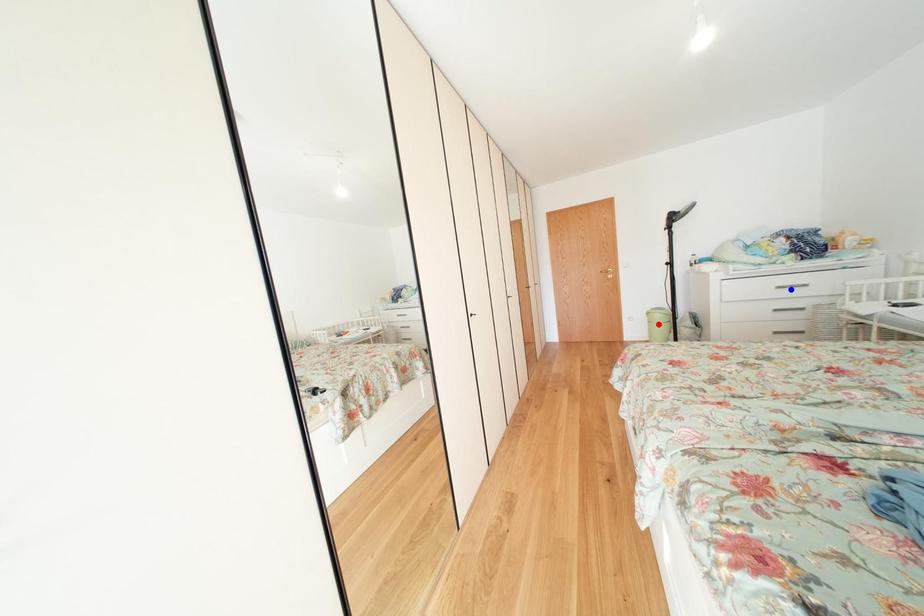
Question: Two points are marked on the image. Which point is closer to the camera?

Choices:
 (A) Blue point is closer.
 (B) Red point is closer.

Answer: (A)